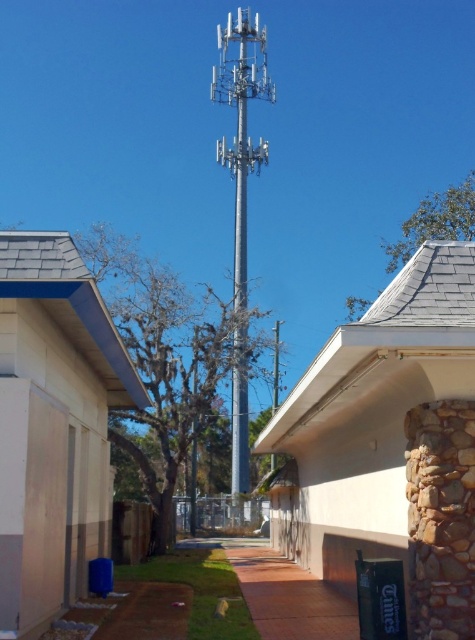
How far apart are silver metallic tower at center and silver metallic pole at center?

silver metallic tower at center is 25.70 inches away from silver metallic pole at center.

Does silver metallic tower at center appear under silver metallic pole at center?

No.

Which is behind, point (247, 413) or point (236, 68)?

Point (236, 68)

At what (x,y) coordinates should I click in order to perform the action: click on silver metallic tower at center. Please return your answer as a coordinate pair (x, y). Looking at the image, I should click on (240, 204).